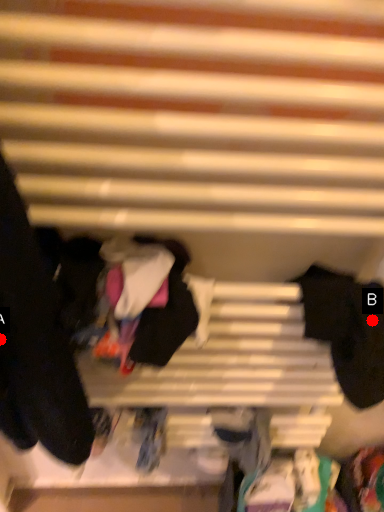
Question: Two points are circled on the image, labeled by A and B beside each circle. Which of the following is the farthest from the observer?

Choices:
 (A) A is further
 (B) B is further

Answer: (B)